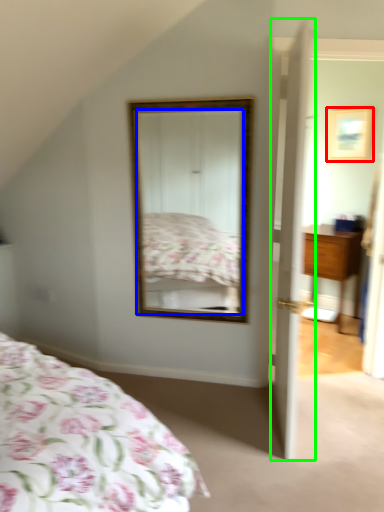
Question: Based on their relative distances, which object is nearer to picture frame (highlighted by a red box)? Choose from mirror (highlighted by a blue box) and door (highlighted by a green box).

Choices:
 (A) mirror
 (B) door

Answer: (A)